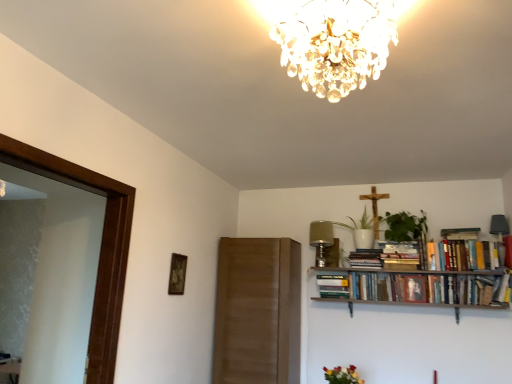
Question: Would you say vibrant bouquet at lower center is a long distance from hardcover books at upper right, arranged as the 3th book when viewed from the right?

Choices:
 (A) no
 (B) yes

Answer: (A)

Question: Considering the relative sizes of vibrant bouquet at lower center and hardcover books at upper right, the 2th book in the left-to-right sequence, in the image provided, is vibrant bouquet at lower center taller than hardcover books at upper right, the 2th book in the left-to-right sequence,?

Choices:
 (A) no
 (B) yes

Answer: (A)

Question: From the image's perspective, is vibrant bouquet at lower center located beneath hardcover books at upper right, arranged as the 3th book when viewed from the right?

Choices:
 (A) no
 (B) yes

Answer: (B)

Question: Is vibrant bouquet at lower center facing away from hardcover books at upper right, arranged as the 3th book when viewed from the right?

Choices:
 (A) yes
 (B) no

Answer: (B)

Question: Considering the relative sizes of vibrant bouquet at lower center and hardcover books at upper right, arranged as the 3th book when viewed from the right, in the image provided, is vibrant bouquet at lower center bigger than hardcover books at upper right, arranged as the 3th book when viewed from the right,?

Choices:
 (A) yes
 (B) no

Answer: (B)

Question: From the image's perspective, is wooden picture frame at upper left above or below vibrant bouquet at lower center?

Choices:
 (A) above
 (B) below

Answer: (A)

Question: Considering the positions of wooden picture frame at upper left and vibrant bouquet at lower center in the image, is wooden picture frame at upper left taller or shorter than vibrant bouquet at lower center?

Choices:
 (A) tall
 (B) short

Answer: (A)

Question: Is wooden picture frame at upper left wider or thinner than vibrant bouquet at lower center?

Choices:
 (A) thin
 (B) wide

Answer: (A)

Question: Considering the positions of wooden picture frame at upper left and vibrant bouquet at lower center in the image, is wooden picture frame at upper left bigger or smaller than vibrant bouquet at lower center?

Choices:
 (A) small
 (B) big

Answer: (A)

Question: In the image, is hardcover books at right, the 3th book viewed from the left, on the left side or the right side of hardcover book at upper center, the 1th book viewed from the left?

Choices:
 (A) left
 (B) right

Answer: (B)

Question: From a real-world perspective, relative to hardcover book at upper center, positioned as the 4th book in right-to-left order, is hardcover books at right, positioned as the 2th book in right-to-left order, vertically above or below?

Choices:
 (A) below
 (B) above

Answer: (B)

Question: Considering the positions of hardcover books at right, the 3th book viewed from the left, and hardcover book at upper center, positioned as the 4th book in right-to-left order, in the image, is hardcover books at right, the 3th book viewed from the left, wider or thinner than hardcover book at upper center, positioned as the 4th book in right-to-left order,?

Choices:
 (A) thin
 (B) wide

Answer: (A)

Question: From the image's perspective, is hardcover books at right, the 3th book viewed from the left, located above or below hardcover book at upper center, the 1th book viewed from the left?

Choices:
 (A) above
 (B) below

Answer: (A)

Question: Looking at their shapes, would you say vibrant bouquet at lower center is wider or thinner than hardcover books at upper right, arranged as the 3th book when viewed from the right?

Choices:
 (A) wide
 (B) thin

Answer: (A)

Question: Does point (334, 370) appear closer or farther from the camera than point (375, 261)?

Choices:
 (A) closer
 (B) farther

Answer: (A)